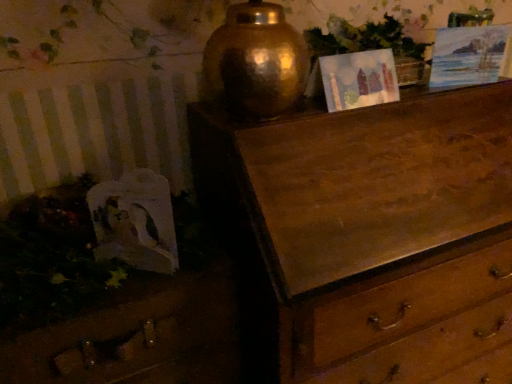
Identify the location of free space in front of matte paper picture frame at upper center, which is counted as the first picture frame, starting from the left. (334, 115).